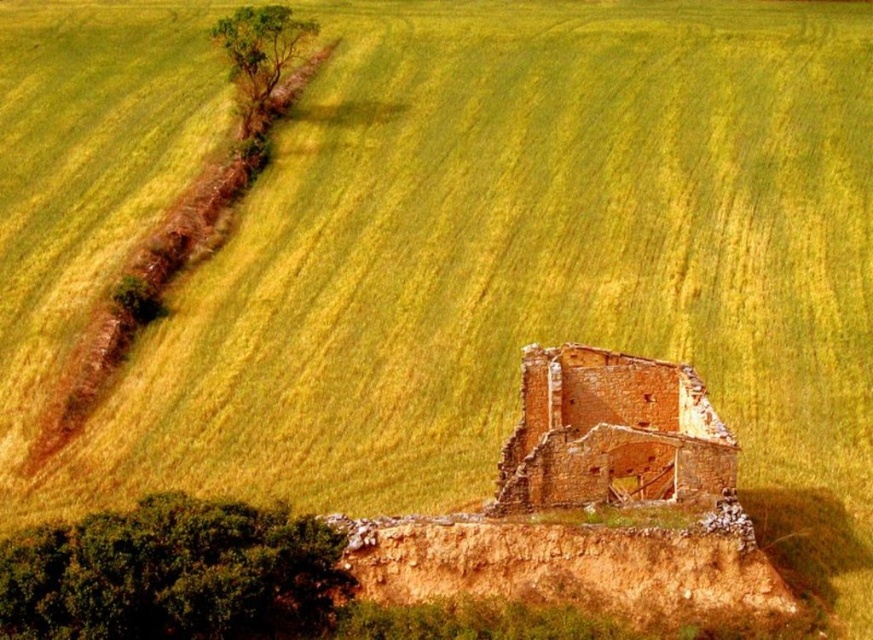
You are a hiker who wants to take a photo of the brick wall ruins at center and the green leafy tree at lower left. Which object should you place on the left side of your photo frame?

The green leafy tree at lower left should be placed on the left side of the photo frame because it is already positioned on the left side of the brick wall ruins at center in the scene.